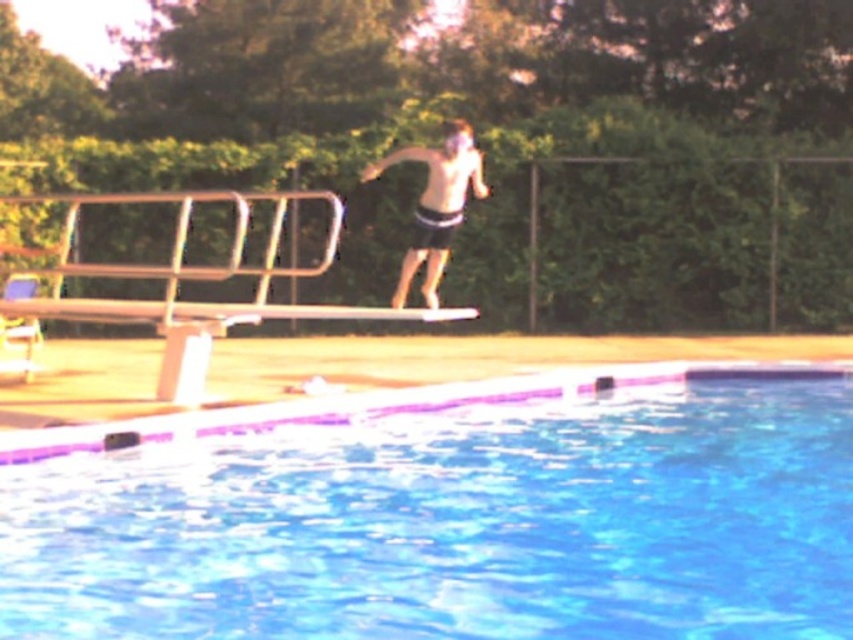
You are standing at the edge of the pool and want to jump into the transparent plastic water at lower center. Where should you aim for? Please provide coordinates in the format of x,y where x and y are between 0 and 1.

You should aim for the coordinates (454, 515) to jump into the transparent plastic water at lower center.

You are a lifeguard on duty and notice a swimmer wearing dark gray shorts at center. You need to quickly assess if they are submerged in the transparent plastic water at lower center. Based on the scene, is the swimmer currently underwater?

The transparent plastic water at lower center is located below dark gray shorts at center, meaning the swimmer wearing dark gray shorts at center is submerged in the water.